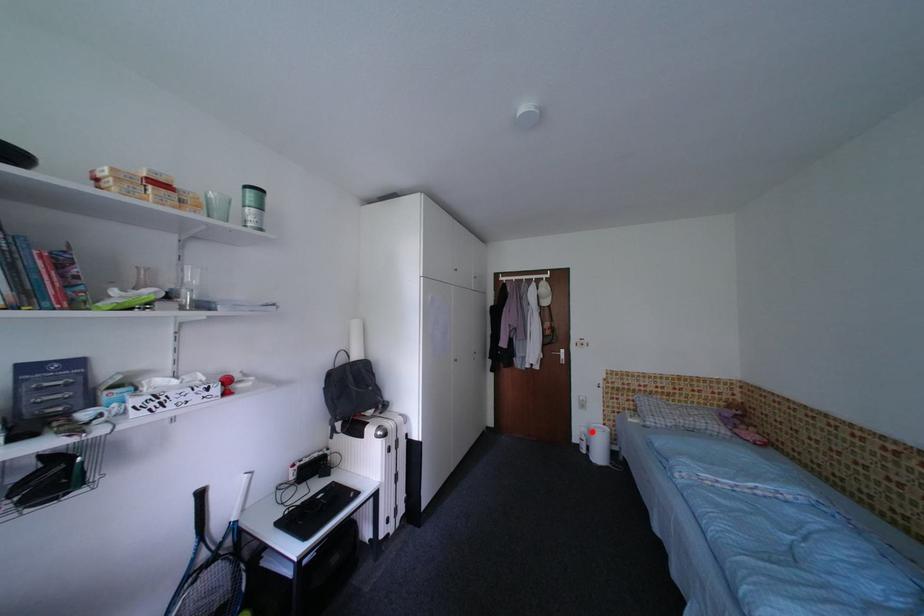
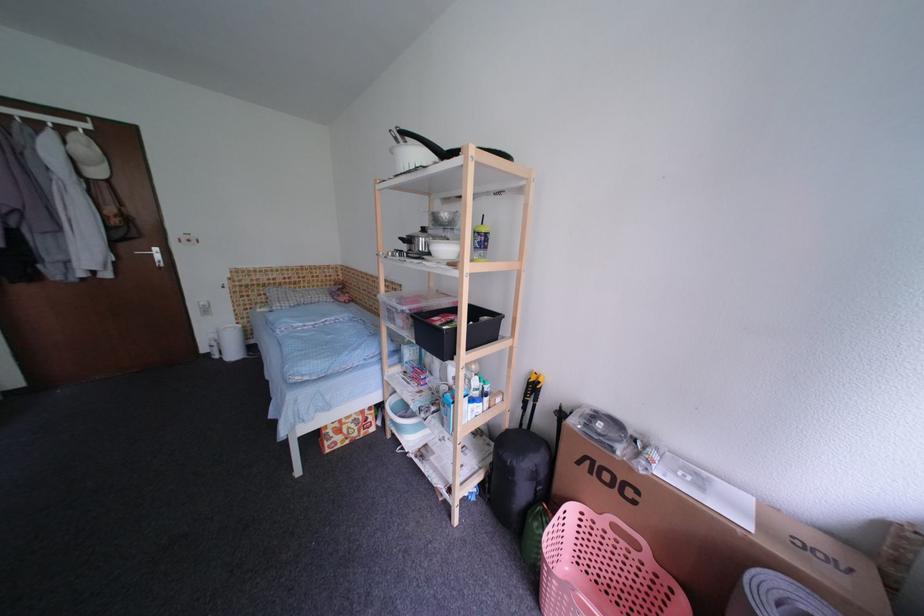
Question: I am providing you with two images of the same scene from different viewpoints. In image1, a red point is highlighted. Considering the same 3D point in image2, which of the following is correct?

Choices:
 (A) It is closer
 (B) It is farther

Answer: (A)